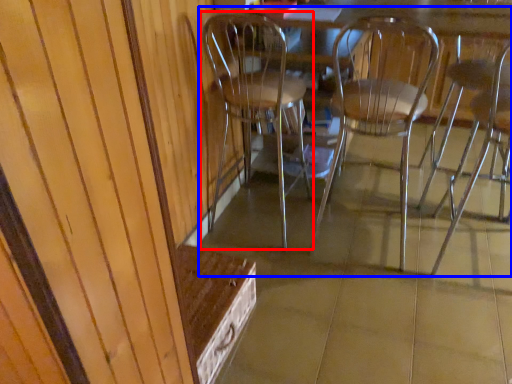
Question: Which object appears closest to the camera in this image, chair (highlighted by a red box) or chair (highlighted by a blue box)?

Choices:
 (A) chair
 (B) chair

Answer: (B)